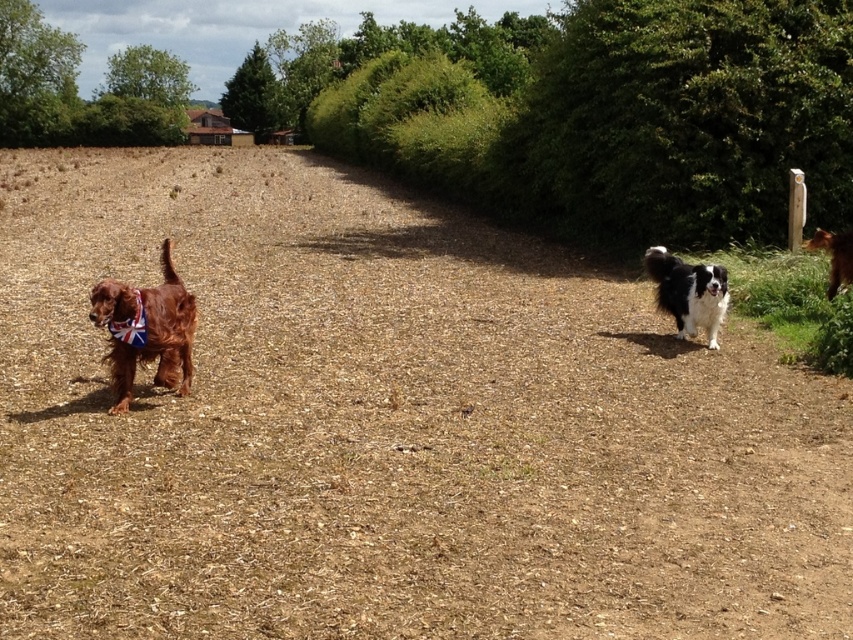
Is shiny brown dog at left positioned at the back of black and white fur at right?

No.

This screenshot has width=853, height=640. What do you see at coordinates (148, 330) in the screenshot?
I see `shiny brown dog at left` at bounding box center [148, 330].

Is point (158, 296) less distant than point (647, 259)?

Yes, point (158, 296) is closer to viewer.

Locate an element on the screen. Image resolution: width=853 pixels, height=640 pixels. shiny brown dog at left is located at coordinates (148, 330).

Is shiny brown dog at left closer to the viewer compared to brown furry dog at right?

Yes.

Is point (96, 288) positioned in front of point (834, 248)?

Yes.

Does point (134, 364) lie behind point (840, 252)?

That is False.

At what (x,y) coordinates should I click in order to perform the action: click on shiny brown dog at left. Please return your answer as a coordinate pair (x, y). Looking at the image, I should click on (148, 330).

What do you see at coordinates (688, 292) in the screenshot? The image size is (853, 640). I see `black and white fur at right` at bounding box center [688, 292].

Does black and white fur at right have a greater width compared to brown furry dog at right?

Yes, black and white fur at right is wider than brown furry dog at right.

Where is `black and white fur at right`? The height and width of the screenshot is (640, 853). black and white fur at right is located at coordinates (688, 292).

Find the location of a particular element. The width and height of the screenshot is (853, 640). black and white fur at right is located at coordinates (688, 292).